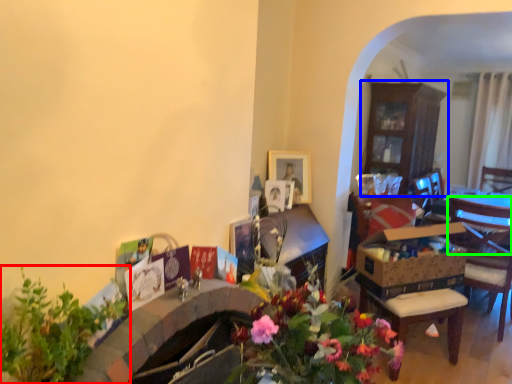
Question: Which object is the farthest from houseplant (highlighted by a red box)? Choose among these: cabinetry (highlighted by a blue box) or chair (highlighted by a green box).

Choices:
 (A) cabinetry
 (B) chair

Answer: (A)